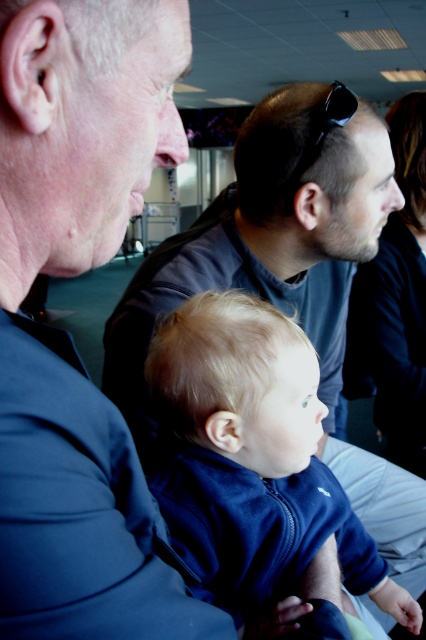
I want to click on blue fleece jacket at center, so click(x=253, y=458).

Is the position of blue fleece jacket at center less distant than that of black plastic sunglasses at upper center?

Yes, blue fleece jacket at center is in front of black plastic sunglasses at upper center.

Is point (348, 509) positioned before point (333, 88)?

Yes, point (348, 509) is closer to viewer.

Find the location of a particular element. blue fleece jacket at center is located at coordinates (x=253, y=458).